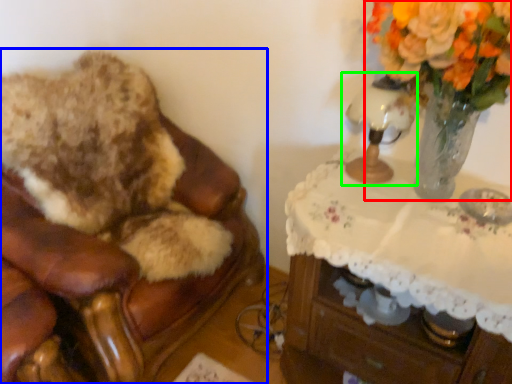
Question: Which object is positioned farthest from floral arrangement (highlighted by a red box)? Select from furniture (highlighted by a blue box) and table lamp (highlighted by a green box).

Choices:
 (A) furniture
 (B) table lamp

Answer: (A)